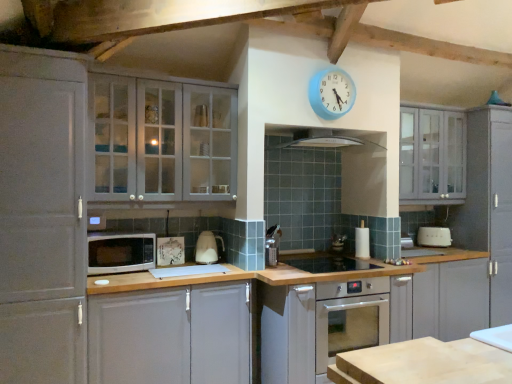
This screenshot has height=384, width=512. What do you see at coordinates (163, 140) in the screenshot?
I see `matte gray cabinet at upper left, which ranks as the 3th cabinetry in right-to-left order` at bounding box center [163, 140].

Image resolution: width=512 pixels, height=384 pixels. What do you see at coordinates (432, 156) in the screenshot? I see `matte gray cabinet at upper right, the first cabinetry from the right` at bounding box center [432, 156].

The image size is (512, 384). Describe the element at coordinates (321, 140) in the screenshot. I see `satin silver exhaust hood at center` at that location.

The image size is (512, 384). Describe the element at coordinates (207, 248) in the screenshot. I see `white glossy electric kettle at center, which is the 3th appliance from back to front` at that location.

In order to click on white glossy electric kettle at center, the 1th appliance in the left-to-right sequence in this screenshot , I will do `click(207, 248)`.

What are the coordinates of `matte gray cabinet at upper left, acting as the second cabinetry starting from the left` in the screenshot? It's located at (163, 140).

Which of these two, white plastic toaster at right, the fourth appliance in the left-to-right sequence, or white matte microwave at lower left, stands taller?

white matte microwave at lower left.

Considering the positions of points (440, 229) and (119, 267), is point (440, 229) closer to camera compared to point (119, 267)?

No.

Which of these two, white plastic toaster at right, the 1th appliance positioned from the back, or white matte microwave at lower left, is smaller?

Smaller between the two is white plastic toaster at right, the 1th appliance positioned from the back.

From the image's perspective, which is above, white plastic toaster at right, the fourth appliance in the left-to-right sequence, or shiny stainless steel sink at center, the fourth appliance when ordered from back to front?

white plastic toaster at right, the fourth appliance in the left-to-right sequence, from the image's perspective.

Considering the relative sizes of white plastic toaster at right, acting as the 4th appliance starting from the front, and shiny stainless steel sink at center, positioned as the third appliance in right-to-left order, in the image provided, is white plastic toaster at right, acting as the 4th appliance starting from the front, taller than shiny stainless steel sink at center, positioned as the third appliance in right-to-left order,?

Correct, white plastic toaster at right, acting as the 4th appliance starting from the front, is much taller as shiny stainless steel sink at center, positioned as the third appliance in right-to-left order.

Between white plastic toaster at right, the 1th appliance positioned from the back, and shiny stainless steel sink at center, positioned as the 2th appliance in left-to-right order, which one has larger size?

Bigger between the two is white plastic toaster at right, the 1th appliance positioned from the back.

From the picture: Would you say white plastic toaster at right, the fourth appliance in the left-to-right sequence, is to the left or to the right of shiny stainless steel sink at center, placed as the first appliance when sorted from front to back, in the picture?

white plastic toaster at right, the fourth appliance in the left-to-right sequence, is to the right of shiny stainless steel sink at center, placed as the first appliance when sorted from front to back.

From a real-world perspective, between matte gray cabinet at upper right, the first cabinetry from the right, and white matte cabinet at lower left, placed as the second cabinetry when sorted from right to left, who is vertically higher?

From a 3D spatial view, matte gray cabinet at upper right, the first cabinetry from the right, is above.

Based on the photo, who is bigger, matte gray cabinet at upper right, the fourth cabinetry in the left-to-right sequence, or white matte cabinet at lower left, the 3th cabinetry viewed from the left?

With larger size is white matte cabinet at lower left, the 3th cabinetry viewed from the left.

Does matte gray cabinet at upper right, the first cabinetry from the right, appear on the left side of white matte cabinet at lower left, the 3th cabinetry viewed from the left?

No.

From the image's perspective, is white plastic toaster at right, acting as the 4th appliance starting from the front, positioned above or below white matte cabinet at lower left, placed as the second cabinetry when sorted from right to left?

Based on their image positions, white plastic toaster at right, acting as the 4th appliance starting from the front, is located above white matte cabinet at lower left, placed as the second cabinetry when sorted from right to left.

Find the location of `the 3rd appliance above the white matte cabinet at lower left, the 3th cabinetry viewed from the left (from the image's perspective)`. the 3rd appliance above the white matte cabinet at lower left, the 3th cabinetry viewed from the left (from the image's perspective) is located at coordinates (434, 237).

Is white plastic toaster at right, the 1th appliance positioned from the back, beside white matte cabinet at lower left, placed as the second cabinetry when sorted from right to left?

No.

Measure the distance between metallic silver toaster at center, the 3th appliance from the left, and white matte microwave at lower left.

The distance of metallic silver toaster at center, the 3th appliance from the left, from white matte microwave at lower left is 1.76 meters.

Does metallic silver toaster at center, which is the 3th appliance from front to back, have a larger size compared to white matte microwave at lower left?

Actually, metallic silver toaster at center, which is the 3th appliance from front to back, might be smaller than white matte microwave at lower left.

The height and width of the screenshot is (384, 512). I want to click on the 3rd appliance behind the white matte microwave at lower left, starting your count from the anchor, so point(338,242).

Is blue plastic clock at upper center thinner than matte gray cabinet at upper right, the fourth cabinetry in the left-to-right sequence?

Yes, blue plastic clock at upper center is thinner than matte gray cabinet at upper right, the fourth cabinetry in the left-to-right sequence.

From a real-world perspective, is blue plastic clock at upper center positioned under matte gray cabinet at upper right, the first cabinetry from the right, based on gravity?

Actually, blue plastic clock at upper center is physically above matte gray cabinet at upper right, the first cabinetry from the right, in the real world.

Is blue plastic clock at upper center aimed at matte gray cabinet at upper right, the fourth cabinetry in the left-to-right sequence?

No, blue plastic clock at upper center is not turned towards matte gray cabinet at upper right, the fourth cabinetry in the left-to-right sequence.

From the image's perspective, would you say blue plastic clock at upper center is shown under matte gray cabinet at upper right, the first cabinetry from the right?

Incorrect, from the image's perspective, blue plastic clock at upper center is higher than matte gray cabinet at upper right, the first cabinetry from the right.

Does point (196, 115) lie behind point (212, 255)?

No, it is not.

Does matte gray cabinet at upper left, which ranks as the 3th cabinetry in right-to-left order, appear on the left side of white glossy electric kettle at center, acting as the 4th appliance starting from the right?

Indeed, matte gray cabinet at upper left, which ranks as the 3th cabinetry in right-to-left order, is positioned on the left side of white glossy electric kettle at center, acting as the 4th appliance starting from the right.

Based on the photo, which object is closer to the camera taking this photo, matte gray cabinet at upper left, which ranks as the 3th cabinetry in right-to-left order, or white glossy electric kettle at center, acting as the 4th appliance starting from the right?

matte gray cabinet at upper left, which ranks as the 3th cabinetry in right-to-left order, is in front.

Starting from the white matte microwave at lower left, which appliance is the 4th one to the right? Please provide its 2D coordinates.

[(434, 237)]

There is a shiny stainless steel sink at center, positioned as the 2th appliance in left-to-right order. At what (x,y) coordinates should I click in order to perform the action: click on the 2nd appliance above it (from a real-world perspective). Please return your answer as a coordinate pair (x, y). The image size is (512, 384). Looking at the image, I should click on (434, 237).

From the image, which object appears to be nearer to white matte microwave at lower left, matte gray cabinet at upper left, acting as the second cabinetry starting from the left, or metallic silver toaster at center, the 2th appliance viewed from the back?

The object closer to white matte microwave at lower left is matte gray cabinet at upper left, acting as the second cabinetry starting from the left.

Which object lies further to the anchor point satin silver exhaust hood at center, white matte microwave at lower left or shiny stainless steel sink at center, the fourth appliance when ordered from back to front?

The object further to satin silver exhaust hood at center is white matte microwave at lower left.

When comparing their distances from matte gray cabinet at upper right, the fourth cabinetry in the left-to-right sequence, does wooden cutting board at lower right or blue plastic clock at upper center seem closer?

blue plastic clock at upper center.

When comparing their distances from matte gray cabinet at upper right, the fourth cabinetry in the left-to-right sequence, does white matte microwave at lower left or matte gray cabinet at upper left, acting as the second cabinetry starting from the left, seem further?

The object further to matte gray cabinet at upper right, the fourth cabinetry in the left-to-right sequence, is white matte microwave at lower left.

Which object lies nearer to the anchor point white matte microwave at lower left, white plastic toaster at right, the 1th appliance viewed from the right, or metallic silver toaster at center, the 3th appliance from the left?

metallic silver toaster at center, the 3th appliance from the left.

Looking at this image, considering their positions, is shiny stainless steel sink at center, placed as the first appliance when sorted from front to back, positioned closer to white matte cabinet at lower left, the 3th cabinetry viewed from the left, than wooden cutting board at lower right?

Based on the image, shiny stainless steel sink at center, placed as the first appliance when sorted from front to back, appears to be nearer to white matte cabinet at lower left, the 3th cabinetry viewed from the left.

Based on the photo, which object lies nearer to the anchor point white matte cabinet at lower left, placed as the second cabinetry when sorted from right to left, blue plastic clock at upper center or satin silver exhaust hood at center?

The object closer to white matte cabinet at lower left, placed as the second cabinetry when sorted from right to left, is satin silver exhaust hood at center.

From the image, which object appears to be farther from white matte microwave at lower left, blue plastic clock at upper center or wooden cutting board at lower right?

Based on the image, wooden cutting board at lower right appears to be further to white matte microwave at lower left.

The image size is (512, 384). In order to click on cabinetry between blue plastic clock at upper center and white plastic toaster at right, the fourth appliance in the left-to-right sequence in this screenshot , I will do `click(432, 156)`.

At what (x,y) coordinates should I click in order to perform the action: click on exhaust hood between white matte microwave at lower left and metallic silver toaster at center, the 3th appliance from the left. Please return your answer as a coordinate pair (x, y). The image size is (512, 384). Looking at the image, I should click on (321, 140).

Locate an element on the screen. The image size is (512, 384). exhaust hood between matte gray cabinet at upper left, acting as the second cabinetry starting from the left, and blue plastic clock at upper center is located at coordinates (321, 140).

The image size is (512, 384). I want to click on microwave oven positioned between wooden cutting board at lower right and blue plastic clock at upper center from near to far, so click(120, 252).